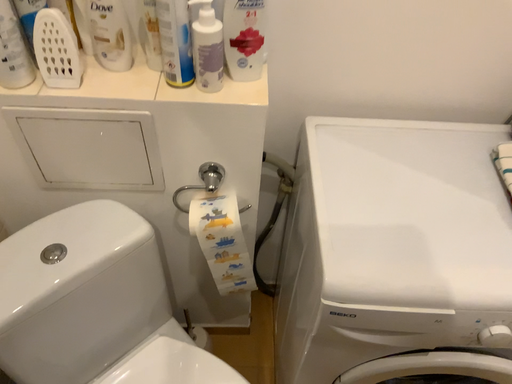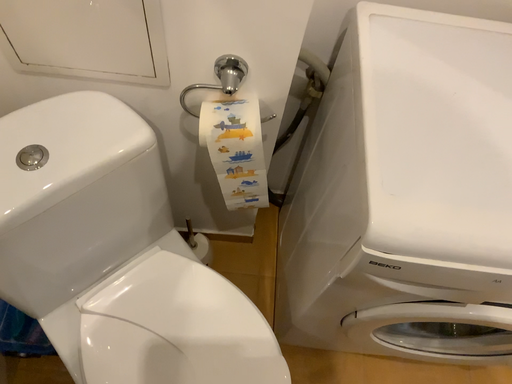
Question: How did the camera likely rotate when shooting the video?

Choices:
 (A) rotated downward
 (B) rotated upward

Answer: (A)